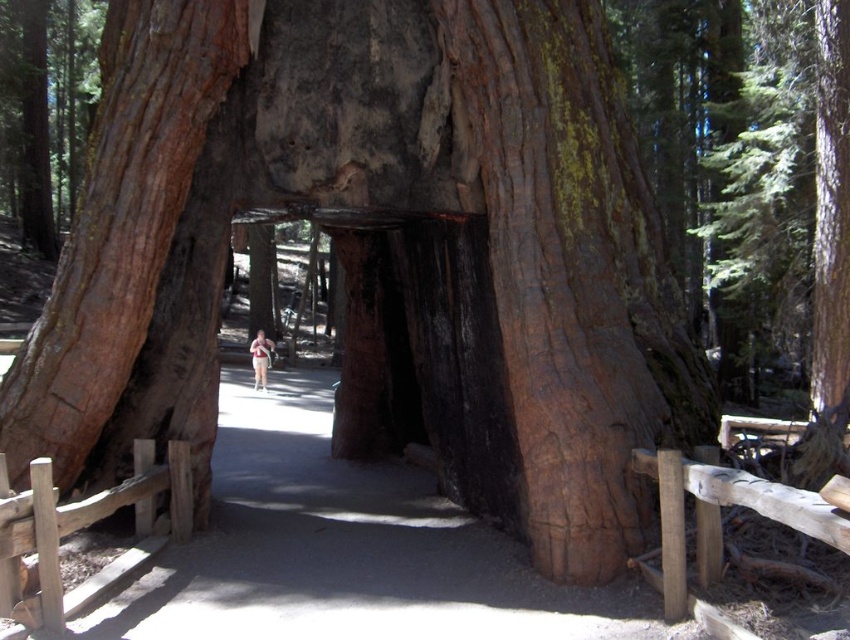
Is smooth brown bark at center to the left of smooth brown bark at left from the viewer's perspective?

In fact, smooth brown bark at center is to the right of smooth brown bark at left.

Does smooth brown bark at center have a larger size compared to smooth brown bark at left?

Yes, smooth brown bark at center is bigger than smooth brown bark at left.

What do you see at coordinates (573, 275) in the screenshot? I see `smooth brown bark at center` at bounding box center [573, 275].

Identify the location of smooth brown bark at center. (573, 275).

Who is shorter, smooth brown bark at left or light brown skin at center?

Standing shorter between the two is light brown skin at center.

Is point (85, 216) closer to camera compared to point (265, 387)?

Yes, point (85, 216) is in front of point (265, 387).

Who is more distant from viewer, (157, 4) or (259, 369)?

The point (259, 369) is behind.

The height and width of the screenshot is (640, 850). Find the location of `smooth brown bark at left`. smooth brown bark at left is located at coordinates (119, 221).

Between smooth brown bark at center and light brown skin at center, which one has more height?

With more height is smooth brown bark at center.

Is point (539, 572) closer to camera compared to point (262, 369)?

Yes, point (539, 572) is in front of point (262, 369).

Describe the element at coordinates (573, 275) in the screenshot. This screenshot has width=850, height=640. I see `smooth brown bark at center` at that location.

I want to click on smooth brown bark at center, so click(573, 275).